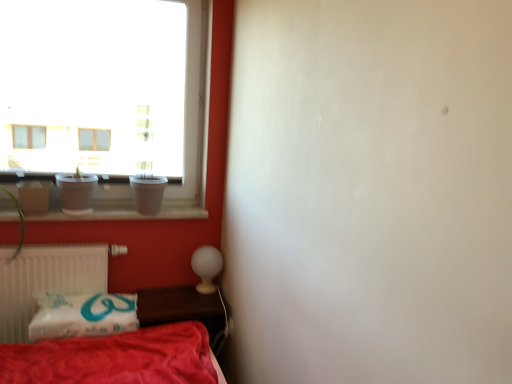
Question: Are transparent glass vase at left and red cotton blanket at lower left making contact?

Choices:
 (A) yes
 (B) no

Answer: (B)

Question: Is transparent glass vase at left positioned far away from red cotton blanket at lower left?

Choices:
 (A) yes
 (B) no

Answer: (B)

Question: From the image's perspective, is transparent glass vase at left located above red cotton blanket at lower left?

Choices:
 (A) yes
 (B) no

Answer: (A)

Question: Considering the relative sizes of transparent glass vase at left and red cotton blanket at lower left in the image provided, is transparent glass vase at left bigger than red cotton blanket at lower left?

Choices:
 (A) no
 (B) yes

Answer: (A)

Question: Is transparent glass vase at left positioned with its back to red cotton blanket at lower left?

Choices:
 (A) no
 (B) yes

Answer: (A)

Question: In terms of size, does transparent glass vase at left appear bigger or smaller than wooden table at lower center?

Choices:
 (A) small
 (B) big

Answer: (A)

Question: From the image's perspective, is transparent glass vase at left above or below wooden table at lower center?

Choices:
 (A) below
 (B) above

Answer: (B)

Question: Is transparent glass vase at left to the left or to the right of wooden table at lower center in the image?

Choices:
 (A) right
 (B) left

Answer: (B)

Question: Looking at their shapes, would you say transparent glass vase at left is wider or thinner than wooden table at lower center?

Choices:
 (A) thin
 (B) wide

Answer: (A)

Question: Looking at their shapes, would you say wooden table at lower center is wider or thinner than green matte plant at left?

Choices:
 (A) wide
 (B) thin

Answer: (A)

Question: In terms of height, does wooden table at lower center look taller or shorter compared to green matte plant at left?

Choices:
 (A) short
 (B) tall

Answer: (A)

Question: From the image's perspective, relative to green matte plant at left, is wooden table at lower center above or below?

Choices:
 (A) below
 (B) above

Answer: (A)

Question: Is point (215, 324) positioned closer to the camera than point (10, 196)?

Choices:
 (A) farther
 (B) closer

Answer: (A)

Question: In the image, is white plastic radiator at lower left positioned in front of or behind wooden table at lower center?

Choices:
 (A) behind
 (B) front

Answer: (B)

Question: Visually, is white plastic radiator at lower left positioned to the left or to the right of wooden table at lower center?

Choices:
 (A) left
 (B) right

Answer: (A)